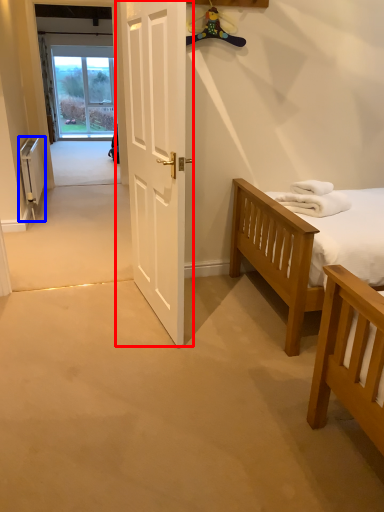
Question: Which of the following is the farthest to the observer, door (highlighted by a red box) or radiator (highlighted by a blue box)?

Choices:
 (A) door
 (B) radiator

Answer: (B)